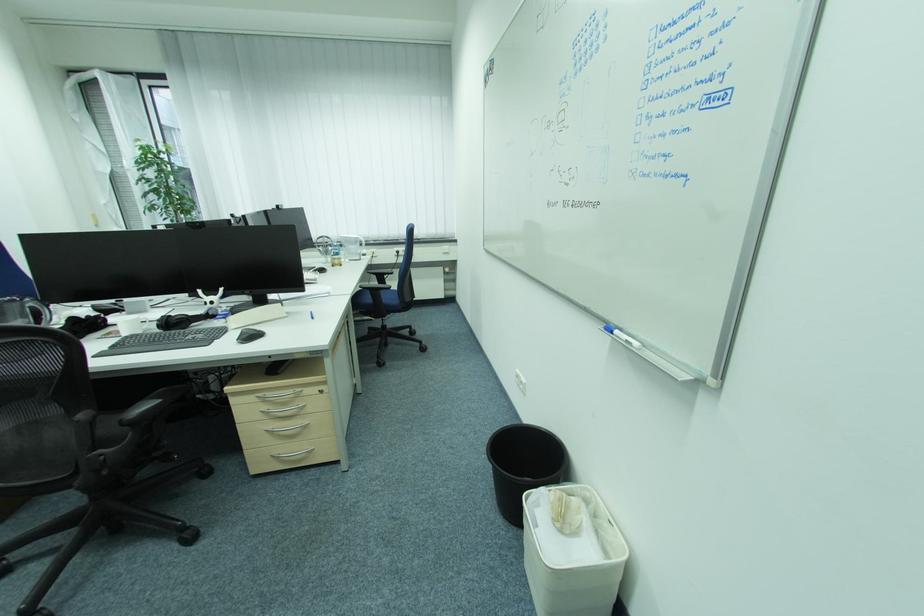
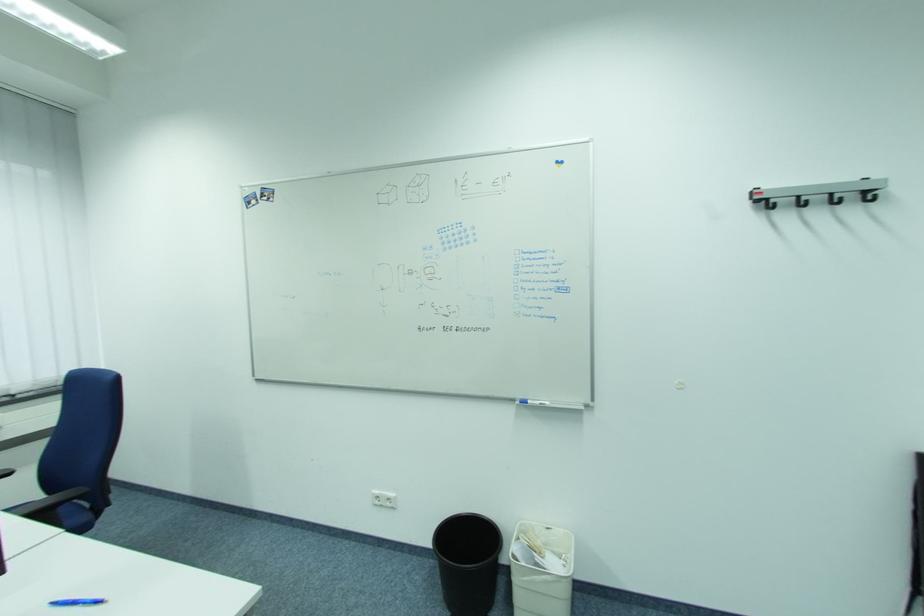
Find the pixel in the second image that matches [523,373] in the first image.

(380, 496)